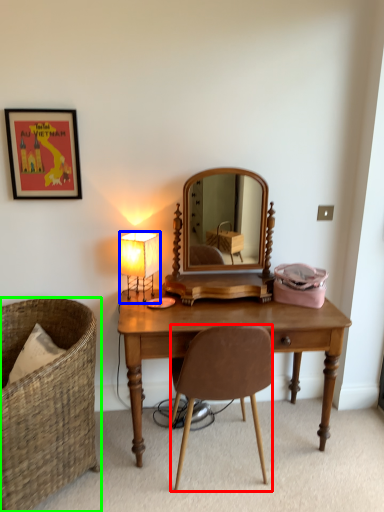
Question: Which object is positioned closest to chair (highlighted by a red box)? Select from lamp (highlighted by a blue box) and chair (highlighted by a green box).

Choices:
 (A) lamp
 (B) chair

Answer: (B)